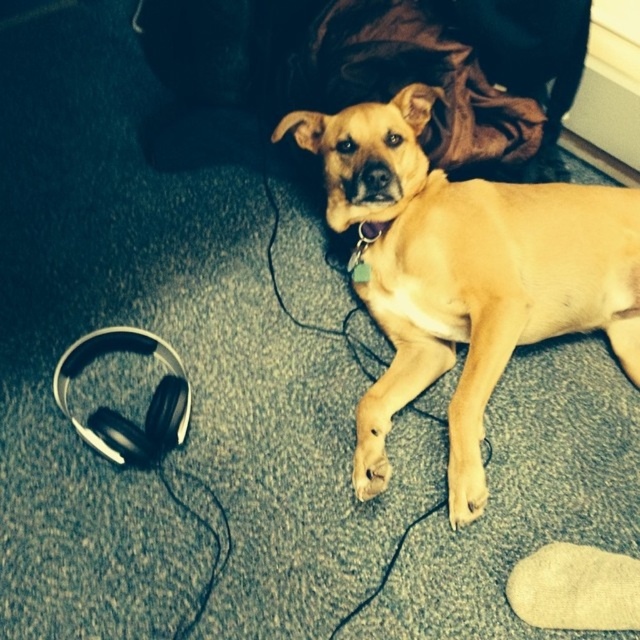
You are a dog owner who wants to place a small treat between the light brown fur paw at lower center and the light brown fur at lower center. Can you fit the treat in the space between them if the treat is 6 inches long?

The space between the light brown fur paw at lower center and the light brown fur at lower center is 5.92 inches, which is slightly less than the 6 inch treat. Therefore, the treat cannot fit in the space between them.

In the scene shown: You are a photographer setting up a shoot. You need to position a small reflector to bounce light onto the golden matte dog at center without shining it on the black matte headphones at lower left. Where should you place the reflector relative to the dog?

The golden matte dog at center is above the black matte headphones at lower left. To avoid shining light on the headphones, place the reflector below the dog, closer to the headphones, so the light reflects upward toward the dog but away from the headphones.

You are a delivery robot with a 12 inch wide package. You need to move from the entrance to the living room to the kitchen. The entrance is near the black matte headphones at lower left. The kitchen is near the light brown fur paw at lower center. Can you navigate through the space between them without moving the objects?

The distance between the black matte headphones at lower left and the light brown fur paw at lower center is 16.68 inches. Since your package is 12 inches wide, there is enough space to navigate between them without moving the objects.